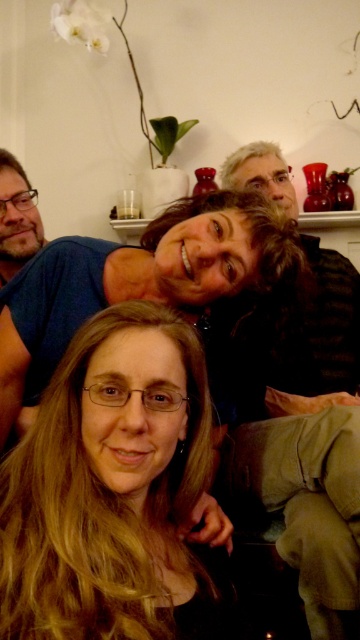
Which is above, blonde hair at center or dark brown textured jacket at upper right?

dark brown textured jacket at upper right is higher up.

Who is more forward, (129, 529) or (272, 440)?

Point (129, 529) is in front.

This screenshot has width=360, height=640. In order to click on blonde hair at center in this screenshot , I will do [105, 497].

Does blonde hair at center lie in front of matte black hair at lower left?

Yes, blonde hair at center is in front of matte black hair at lower left.

Which is above, blonde hair at center or matte black hair at lower left?

matte black hair at lower left is above.

Is point (39, 577) positioned after point (277, 275)?

No, it is in front of (277, 275).

Identify the location of blonde hair at center. This screenshot has width=360, height=640. (105, 497).

Is dark brown textured jacket at upper right thinner than matte black hair at lower left?

Yes.

Can you confirm if dark brown textured jacket at upper right is wider than matte black hair at lower left?

In fact, dark brown textured jacket at upper right might be narrower than matte black hair at lower left.

Is point (348, 502) less distant than point (46, 312)?

No, it is behind (46, 312).

Where is `dark brown textured jacket at upper right`? dark brown textured jacket at upper right is located at coordinates (312, 444).